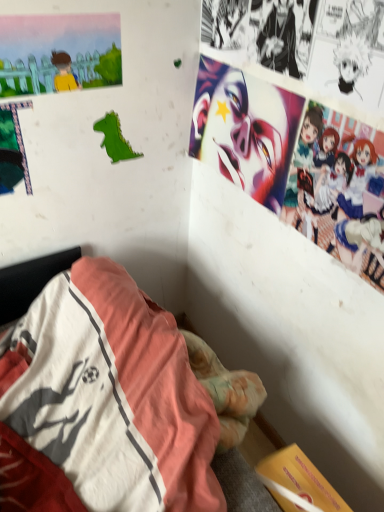
Question: Is vivid matte clown face at upper right not near green paper dinosaur at upper left?

Choices:
 (A) no
 (B) yes

Answer: (A)

Question: Considering the relative sizes of vivid matte clown face at upper right and green paper dinosaur at upper left in the image provided, is vivid matte clown face at upper right smaller than green paper dinosaur at upper left?

Choices:
 (A) yes
 (B) no

Answer: (B)

Question: Is vivid matte clown face at upper right with green paper dinosaur at upper left?

Choices:
 (A) no
 (B) yes

Answer: (A)

Question: From the image's perspective, would you say vivid matte clown face at upper right is positioned over green paper dinosaur at upper left?

Choices:
 (A) no
 (B) yes

Answer: (A)

Question: Is vivid matte clown face at upper right oriented away from green paper dinosaur at upper left?

Choices:
 (A) no
 (B) yes

Answer: (A)

Question: Is vivid matte clown face at upper right thinner than green paper dinosaur at upper left?

Choices:
 (A) no
 (B) yes

Answer: (A)

Question: Is black paper at upper right, which ranks as the first person in left-to-right order, inside vivid matte clown face at upper right?

Choices:
 (A) yes
 (B) no

Answer: (B)

Question: Is vivid matte clown face at upper right oriented towards black paper at upper right, the 1th person positioned from the top?

Choices:
 (A) no
 (B) yes

Answer: (A)

Question: Considering the relative sizes of vivid matte clown face at upper right and black paper at upper right, the 1th person positioned from the top, in the image provided, is vivid matte clown face at upper right thinner than black paper at upper right, the 1th person positioned from the top,?

Choices:
 (A) no
 (B) yes

Answer: (A)

Question: Is vivid matte clown face at upper right bigger than black paper at upper right, the 2th person in the bottom-to-top sequence?

Choices:
 (A) yes
 (B) no

Answer: (A)

Question: Does vivid matte clown face at upper right appear on the right side of black paper at upper right, the 1th person positioned from the top?

Choices:
 (A) no
 (B) yes

Answer: (A)

Question: Is vivid matte clown face at upper right taller than black paper at upper right, arranged as the 2th person when viewed from the right?

Choices:
 (A) no
 (B) yes

Answer: (B)

Question: Is the position of black paper at upper right, the 1th person positioned from the top, more distant than that of pastel-colored anime characters at upper right, the first person positioned from the right?

Choices:
 (A) no
 (B) yes

Answer: (B)